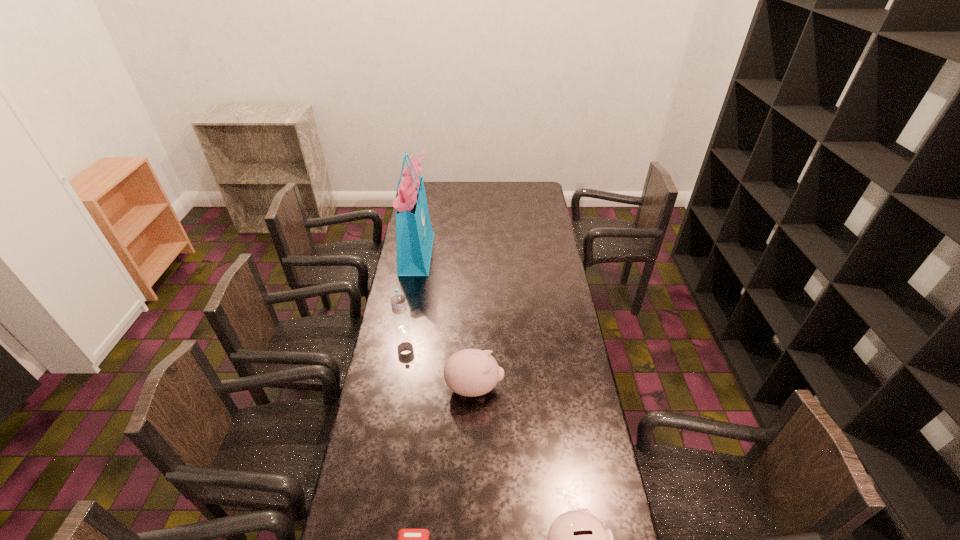
Locate an element on the screen. This screenshot has height=540, width=960. water bottle positioned at the left edge is located at coordinates (x=398, y=299).

In the image, there is a desktop. At what (x,y) coordinates should I click in order to perform the action: click on blank space at the far edge. Please return your answer as a coordinate pair (x, y). The width and height of the screenshot is (960, 540). Looking at the image, I should click on (453, 198).

At what (x,y) coordinates should I click in order to perform the action: click on vacant space at the left edge of the desktop. Please return your answer as a coordinate pair (x, y). The width and height of the screenshot is (960, 540). Looking at the image, I should click on (381, 341).

I want to click on vacant space at the right edge of the desktop, so click(557, 317).

The height and width of the screenshot is (540, 960). I want to click on free space at the far right corner of the desktop, so click(x=527, y=195).

Identify the location of vacant area that lies between the fourth nearest object and the farthest object. (410, 291).

Locate an element on the screen. The height and width of the screenshot is (540, 960). vacant point located between the left piggy bank and the fourth nearest object is located at coordinates click(x=439, y=359).

Choose which object is the nearest neighbor to the nearer piggy bank. Please provide its 2D coordinates. Your answer should be formatted as a tuple, i.e. [(x, y)], where the tuple contains the x and y coordinates of a point satisfying the conditions above.

[(408, 539)]

Locate which object ranks in proximity to the fourth shortest object. Please provide its 2D coordinates. Your answer should be formatted as a tuple, i.e. [(x, y)], where the tuple contains the x and y coordinates of a point satisfying the conditions above.

[(470, 372)]